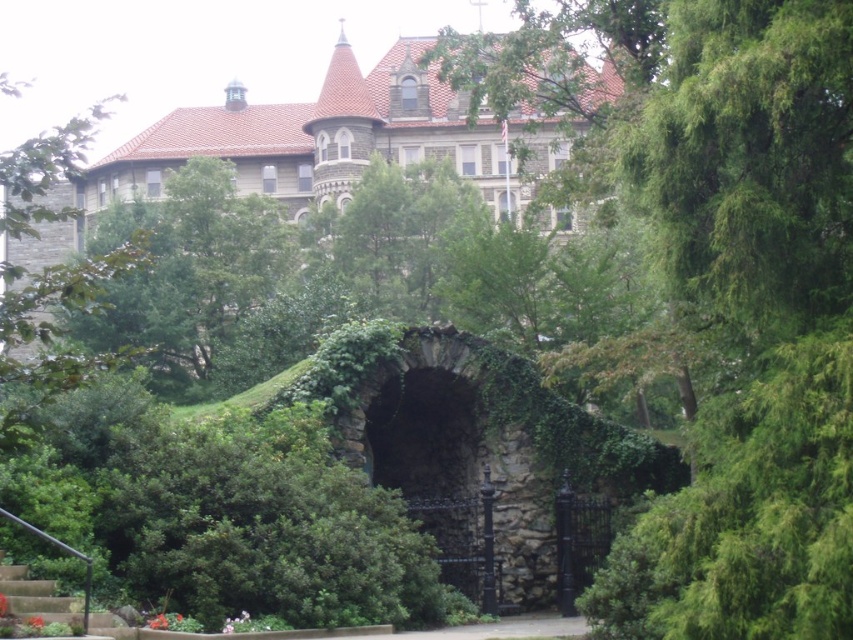
Does gray stone castle at upper center have a greater width compared to rustic stone archway at center?

Yes, gray stone castle at upper center is wider than rustic stone archway at center.

Is point (242, 138) closer to camera compared to point (410, 504)?

No, it is not.

Identify the location of gray stone castle at upper center. (334, 138).

From the picture: Who is lower down, gray stone castle at upper center or concrete stairs at lower left?

concrete stairs at lower left

Who is shorter, gray stone castle at upper center or concrete stairs at lower left?

With less height is concrete stairs at lower left.

Between point (422, 131) and point (26, 596), which one is positioned in front?

Positioned in front is point (26, 596).

This screenshot has width=853, height=640. In order to click on gray stone castle at upper center in this screenshot , I will do `click(334, 138)`.

Which is behind, point (776, 54) or point (65, 618)?

Point (65, 618)

Looking at this image, can you confirm if green leafy tree at center is positioned below concrete stairs at lower left?

No.

Between point (570, 19) and point (0, 580), which one is positioned behind?

The point (570, 19) is behind.

Find the location of a particular element. The width and height of the screenshot is (853, 640). green leafy tree at center is located at coordinates (712, 289).